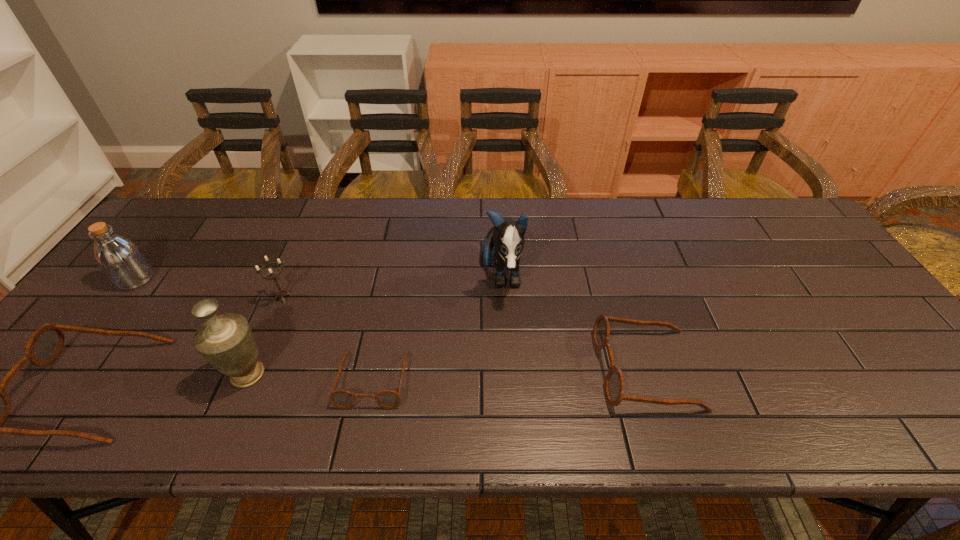
The height and width of the screenshot is (540, 960). What are the coordinates of `vacant place for an extra spectacles on the right` in the screenshot? It's located at (911, 360).